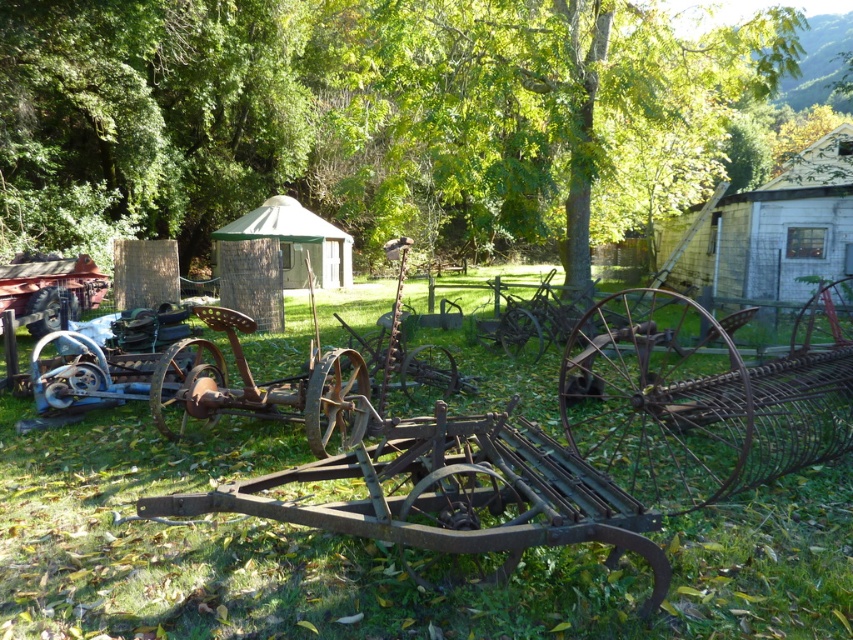
Question: In this image, where is green leafy tree at center located relative to rusty metal wagon at center?

Choices:
 (A) right
 (B) left

Answer: (A)

Question: Is rusty metal rake at right above white brick hut at upper right?

Choices:
 (A) yes
 (B) no

Answer: (B)

Question: Which of these objects is positioned closest to the green leafy tree at upper left?

Choices:
 (A) white brick hut at upper right
 (B) rusty metal wagon at left
 (C) green canvas tent at center
 (D) green leafy tree at center

Answer: (C)

Question: Which point is farther to the camera?

Choices:
 (A) (379, 529)
 (B) (57, 557)

Answer: (B)

Question: Is green leafy tree at center below green leafy tree at upper left?

Choices:
 (A) yes
 (B) no

Answer: (B)

Question: Which is farther from the green rusty grass at center?

Choices:
 (A) green canvas tent at center
 (B) green leafy tree at center
 (C) rusty metal rake at right
 (D) rusty metal wagon at center

Answer: (A)